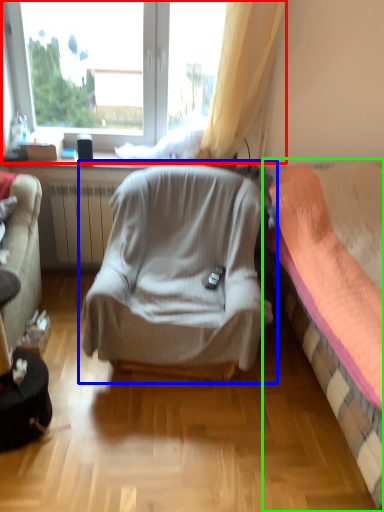
Question: Estimate the real-world distances between objects in this image. Which object is closer to window (highlighted by a red box), chair (highlighted by a blue box) or bed (highlighted by a green box)?

Choices:
 (A) chair
 (B) bed

Answer: (A)